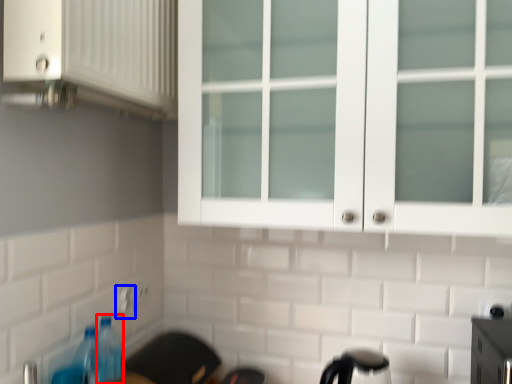
Question: Among these objects, which one is nearest to the camera, bottle (highlighted by a red box) or electric outlet (highlighted by a blue box)?

Choices:
 (A) bottle
 (B) electric outlet

Answer: (A)